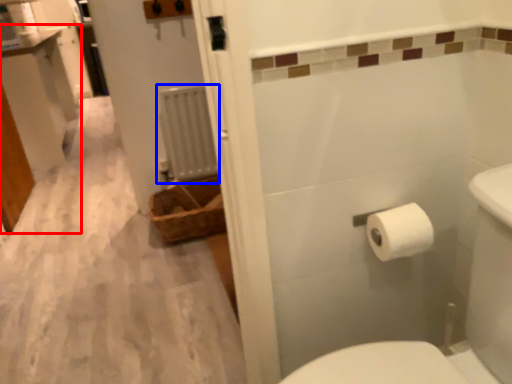
Question: Among these objects, which one is nearest to the camera, vanity (highlighted by a red box) or radiator (highlighted by a blue box)?

Choices:
 (A) vanity
 (B) radiator

Answer: (B)